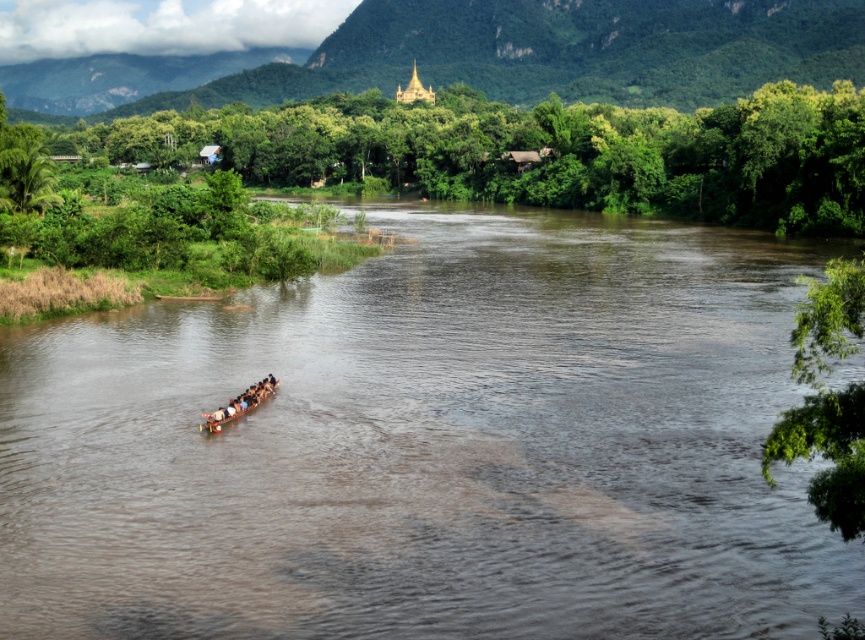
Is brown wooden canoe at center bigger than wooden paddle at center?

No.

Which is in front, point (267, 392) or point (204, 416)?

Point (204, 416) is more forward.

Locate an element on the screen. This screenshot has height=640, width=865. brown wooden canoe at center is located at coordinates (239, 404).

Can you confirm if brown matte water at center is bigger than wooden paddle at center?

Yes.

This screenshot has height=640, width=865. What do you see at coordinates (428, 445) in the screenshot?
I see `brown matte water at center` at bounding box center [428, 445].

Identify the location of brown matte water at center. (428, 445).

Does brown matte water at center appear on the right side of brown wooden canoe at center?

Correct, you'll find brown matte water at center to the right of brown wooden canoe at center.

Which is in front, point (107, 506) or point (274, 378)?

Positioned in front is point (107, 506).

Image resolution: width=865 pixels, height=640 pixels. Find the location of `brown matte water at center`. brown matte water at center is located at coordinates (428, 445).